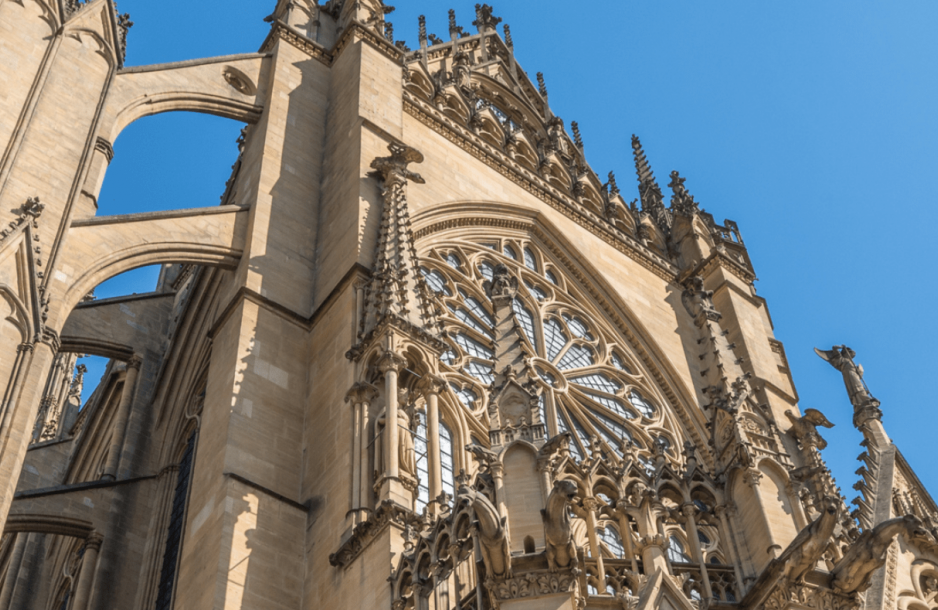
The width and height of the screenshot is (938, 610). In order to click on niche in this screenshot , I will do `click(401, 454)`.